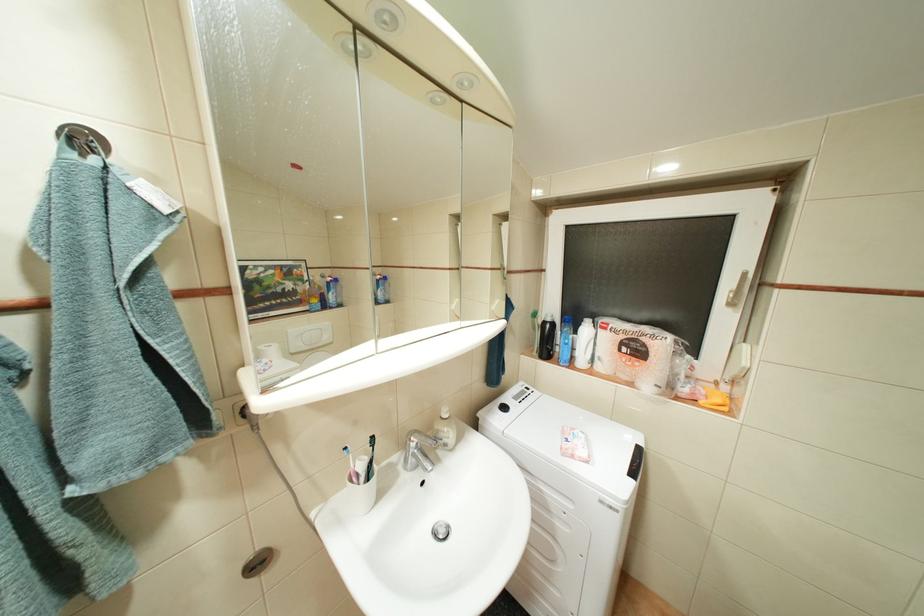
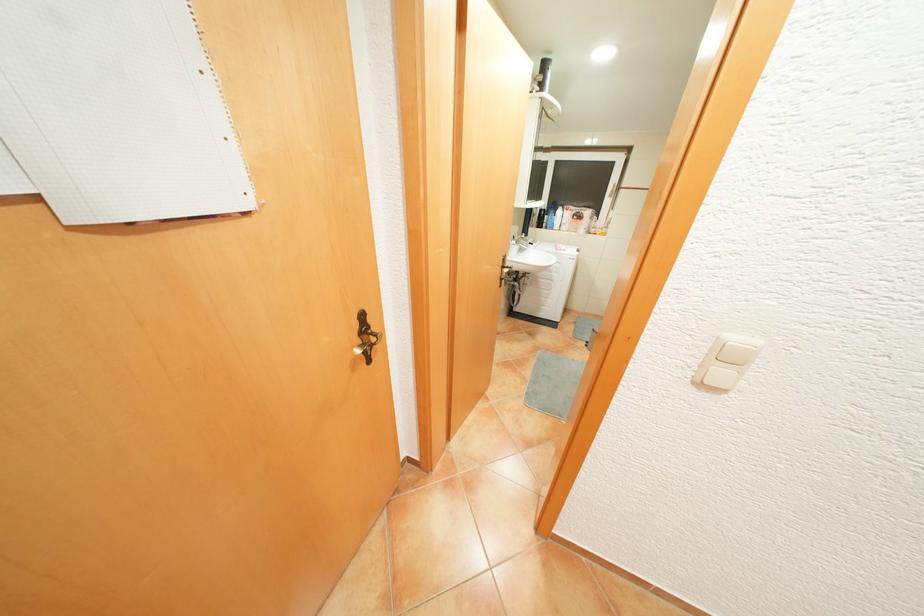
What movement of the cameraman would produce the second image?

The cameraman walked toward left, backward.